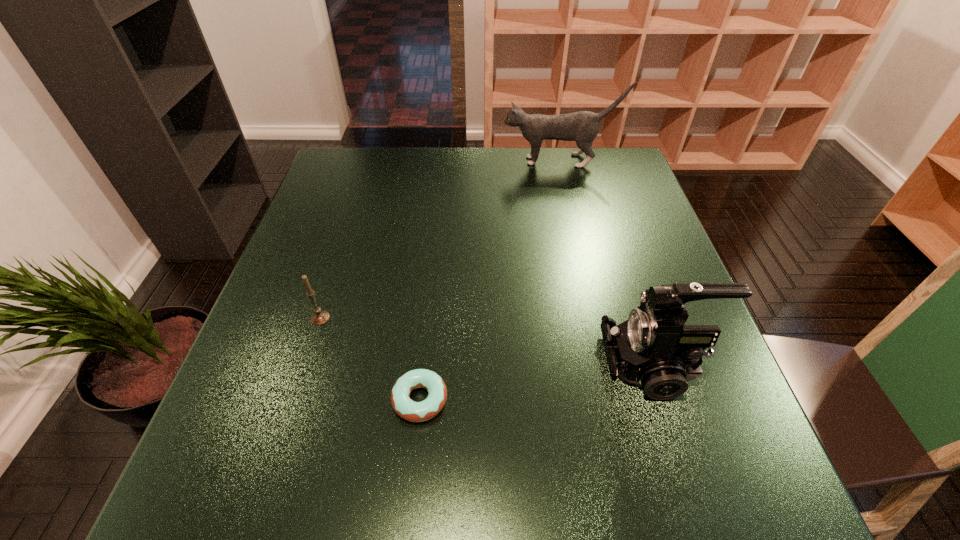
I want to click on unoccupied area between the leftmost object and the second object from left to right, so click(371, 359).

Find the location of a particular element. free space that is in between the second shortest object and the cat is located at coordinates (441, 239).

Where is `free spot between the camcorder and the third object from right to left`? free spot between the camcorder and the third object from right to left is located at coordinates (537, 381).

Locate an element on the screen. The width and height of the screenshot is (960, 540). vacant area that lies between the doughnut and the camcorder is located at coordinates (537, 381).

This screenshot has width=960, height=540. I want to click on free point between the farthest object and the camcorder, so click(x=607, y=262).

Locate an element on the screen. This screenshot has height=540, width=960. free space between the second shortest object and the third object from right to left is located at coordinates (371, 359).

You are a GUI agent. You are given a task and a screenshot of the screen. Output one action in this format:
    pyautogui.click(x=<x>, y=<y>)
    Task: Click on the third closest object relative to the farthest object
    Image resolution: width=960 pixels, height=540 pixels.
    Given the screenshot: What is the action you would take?
    pyautogui.click(x=412, y=411)

The height and width of the screenshot is (540, 960). Find the location of `object that ranks as the second closest to the camcorder`. object that ranks as the second closest to the camcorder is located at coordinates click(x=320, y=317).

Image resolution: width=960 pixels, height=540 pixels. In order to click on vacant position in the image that satisfies the following two spatial constraints: 1. on the lens mount of the camcorder; 2. on the front side of the shortest object in this screenshot , I will do `click(664, 400)`.